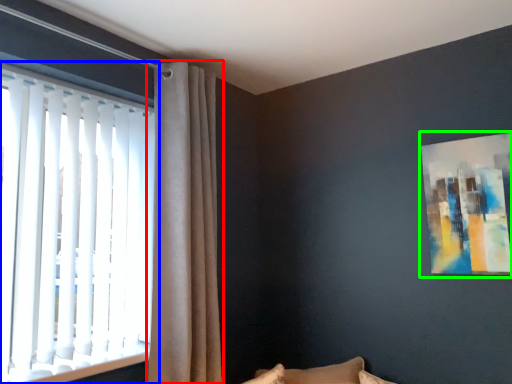
Question: Considering the real-world distances, which object is closest to curtain (highlighted by a red box)? window (highlighted by a blue box) or picture frame (highlighted by a green box).

Choices:
 (A) window
 (B) picture frame

Answer: (A)